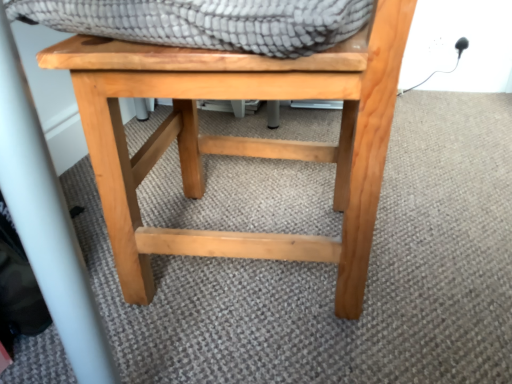
At what (x,y) coordinates should I click in order to perform the action: click on free space underneath natural wood stool at center (from a real-world perspective). Please return your answer as a coordinate pair (x, y). The image size is (512, 384). Looking at the image, I should click on (297, 266).